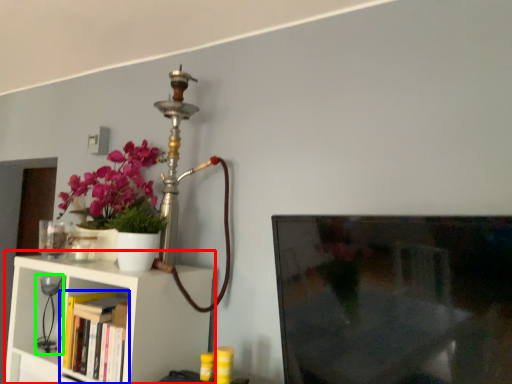
Question: Based on their relative distances, which object is farther from shelf (highlighted by a red box)? Choose from book (highlighted by a blue box) and table lamp (highlighted by a green box).

Choices:
 (A) book
 (B) table lamp

Answer: (B)